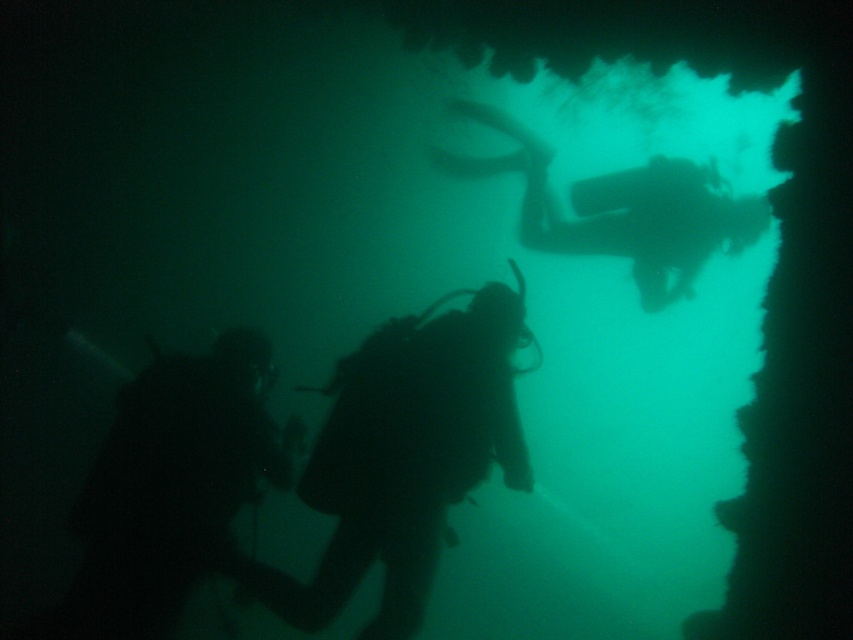
You are a marine biologist planning to join the underwater exploration. You see the black matte scuba diver at center. Based on their position, can you determine if they are positioned closer to the surface or deeper in the water column?

The black matte scuba diver at center is positioned at point [405,458]. Since the y coordinate is 0.476, which is closer to 0.5 than 0, the diver is likely in the middle of the water column, neither closer to the surface nor deeper down.